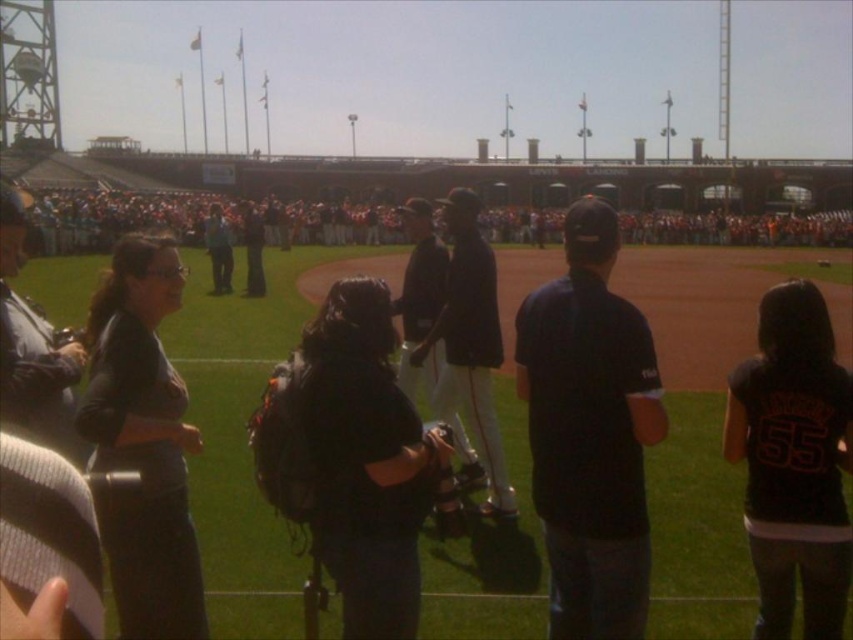
Question: Is black jersey at center bigger than white cotton crowd at center?

Choices:
 (A) no
 (B) yes

Answer: (A)

Question: Does black jersey at center have a smaller size compared to black leather jacket at center?

Choices:
 (A) yes
 (B) no

Answer: (A)

Question: Which is farther from the dark blue uniform at center?

Choices:
 (A) black leather jacket at center
 (B) dark gray hoodie at center
 (C) white cotton crowd at center
 (D) black jersey at center

Answer: (C)

Question: Which point is closer to the camera taking this photo?

Choices:
 (A) (51, 243)
 (B) (444, 604)
 (C) (811, 484)

Answer: (C)

Question: Which object is closer to the camera taking this photo?

Choices:
 (A) dark gray hoodie at center
 (B) black leather jacket at center
 (C) dark blue shirt at center

Answer: (B)

Question: Does black fabric backpack at center appear on the left side of black leather jacket at center?

Choices:
 (A) no
 (B) yes

Answer: (A)